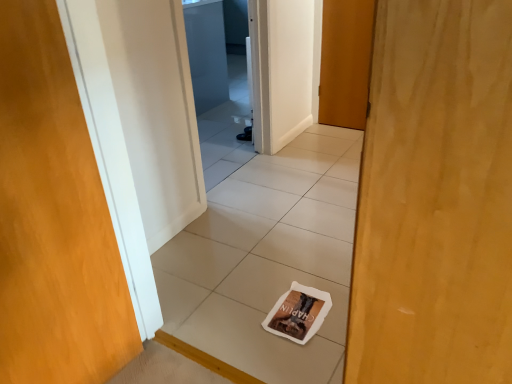
Find the location of a particular element. white tile at center is located at coordinates (268, 258).

The width and height of the screenshot is (512, 384). Find the location of `wooden door at left, which is the first door in bottom-to-top order`. wooden door at left, which is the first door in bottom-to-top order is located at coordinates (53, 218).

Where is `wooden door at center, the 2th door in the front-to-back sequence`? wooden door at center, the 2th door in the front-to-back sequence is located at coordinates click(346, 62).

From a real-world perspective, is transparent glass screen door at upper center physically below brown paper magazine at center?

No.

From the picture: Considering the sizes of objects transparent glass screen door at upper center and brown paper magazine at center in the image provided, who is thinner, transparent glass screen door at upper center or brown paper magazine at center?

With smaller width is brown paper magazine at center.

In the scene shown: Which object is closer to the camera, transparent glass screen door at upper center or brown paper magazine at center?

Positioned in front is brown paper magazine at center.

Which is correct: transparent glass screen door at upper center is inside brown paper magazine at center, or outside of it?

transparent glass screen door at upper center is not inside brown paper magazine at center, it's outside.

Does point (268, 325) come closer to viewer compared to point (192, 43)?

Yes, it is.

Is brown paper magazine at center looking in the opposite direction of transparent glass screen door at upper center?

No.

From the picture: Can you confirm if brown paper magazine at center is bigger than transparent glass screen door at upper center?

Actually, brown paper magazine at center might be smaller than transparent glass screen door at upper center.

Can you see white tile at center touching wooden door at center, the second door positioned from the bottom?

No, white tile at center is not making contact with wooden door at center, the second door positioned from the bottom.

Is white tile at center located outside wooden door at center, the second door positioned from the bottom?

Yes, white tile at center is outside of wooden door at center, the second door positioned from the bottom.

How different are the orientations of white tile at center and wooden door at center, which is the 1th door from top to bottom, in degrees?

The angular difference between white tile at center and wooden door at center, which is the 1th door from top to bottom, is 0.626 degrees.

Looking at this image, looking at the image, does white tile at center seem bigger or smaller compared to wooden door at center, the second door positioned from the bottom?

Clearly, white tile at center is larger in size than wooden door at center, the second door positioned from the bottom.

How many degrees apart are the facing directions of wooden door at left, which is the 2th door from top to bottom, and transparent glass screen door at upper center?

98.4 degrees separate the facing orientations of wooden door at left, which is the 2th door from top to bottom, and transparent glass screen door at upper center.

Is wooden door at left, the 2th door when ordered from right to left, far away from transparent glass screen door at upper center?

Yes, wooden door at left, the 2th door when ordered from right to left, is far from transparent glass screen door at upper center.

Is wooden door at left, which is the first door in front-to-back order, located outside transparent glass screen door at upper center?

Yes.

Considering the positions of objects wooden door at left, the first door when ordered from left to right, and transparent glass screen door at upper center in the image provided, who is more to the left, wooden door at left, the first door when ordered from left to right, or transparent glass screen door at upper center?

wooden door at left, the first door when ordered from left to right.

How distant is brown paper magazine at center from white tile at center?

brown paper magazine at center and white tile at center are 45.52 centimeters apart from each other.

Does brown paper magazine at center appear on the right side of white tile at center?

No, brown paper magazine at center is not to the right of white tile at center.

Is brown paper magazine at center in front of or behind white tile at center in the image?

Clearly, brown paper magazine at center is behind white tile at center.

Does brown paper magazine at center have a smaller size compared to white tile at center?

Yes, brown paper magazine at center is smaller than white tile at center.

From a real-world perspective, is brown paper magazine at center physically located above or below wooden door at left, which is the 2th door from top to bottom?

Clearly, from a real-world perspective, brown paper magazine at center is below wooden door at left, which is the 2th door from top to bottom.

From the image's perspective, who appears lower, brown paper magazine at center or wooden door at left, which is the first door in front-to-back order?

brown paper magazine at center is shown below in the image.

Considering the relative sizes of brown paper magazine at center and wooden door at left, the first door when ordered from left to right, in the image provided, is brown paper magazine at center shorter than wooden door at left, the first door when ordered from left to right,?

Yes.

Can you confirm if brown paper magazine at center is positioned to the right of wooden door at left, which is the first door in front-to-back order?

Yes, brown paper magazine at center is to the right of wooden door at left, which is the first door in front-to-back order.

What's the angular difference between wooden door at center, the 2th door in the front-to-back sequence, and transparent glass screen door at upper center's facing directions?

180 degrees.

Can you confirm if wooden door at center, the 2th door in the front-to-back sequence, is thinner than transparent glass screen door at upper center?

Correct, the width of wooden door at center, the 2th door in the front-to-back sequence, is less than that of transparent glass screen door at upper center.

Between wooden door at center, which is the 1th door in back-to-front order, and transparent glass screen door at upper center, which one appears on the right side from the viewer's perspective?

From the viewer's perspective, wooden door at center, which is the 1th door in back-to-front order, appears more on the right side.

Does wooden door at center, the second door positioned from the bottom, come in front of transparent glass screen door at upper center?

Yes, it is.

Image resolution: width=512 pixels, height=384 pixels. I want to click on screen door that appears behind the brown paper magazine at center, so click(x=207, y=53).

Where is `magazine in front of the transparent glass screen door at upper center`? This screenshot has height=384, width=512. magazine in front of the transparent glass screen door at upper center is located at coordinates (296, 314).

From the image, which object appears to be farther from white tile at center, wooden door at left, the first door when ordered from left to right, or wooden door at center, placed as the 2th door when sorted from left to right?

Among the two, wooden door at center, placed as the 2th door when sorted from left to right, is located further to white tile at center.

Which object lies nearer to the anchor point white tile at center, transparent glass screen door at upper center or wooden door at center, the 2th door in the front-to-back sequence?

Based on the image, wooden door at center, the 2th door in the front-to-back sequence, appears to be nearer to white tile at center.

From the image, which object appears to be farther from wooden door at left, which is the first door in bottom-to-top order, white tile at center or wooden door at center, the second door positioned from the bottom?

wooden door at center, the second door positioned from the bottom, lies further to wooden door at left, which is the first door in bottom-to-top order, than the other object.

Based on their spatial positions, is transparent glass screen door at upper center or wooden door at left, which is counted as the 2th door, starting from the back, closer to brown paper magazine at center?

Among the two, wooden door at left, which is counted as the 2th door, starting from the back, is located nearer to brown paper magazine at center.

Estimate the real-world distances between objects in this image. Which object is closer to white tile at center, brown paper magazine at center or transparent glass screen door at upper center?

brown paper magazine at center is closer to white tile at center.

Looking at the image, which one is located closer to wooden door at center, which is the 1th door in back-to-front order, white tile at center or brown paper magazine at center?

white tile at center.

Which object lies further to the anchor point white tile at center, transparent glass screen door at upper center or wooden door at left, the 2th door when ordered from right to left?

transparent glass screen door at upper center lies further to white tile at center than the other object.

Looking at this image, when comparing their distances from transparent glass screen door at upper center, does brown paper magazine at center or white tile at center seem further?

brown paper magazine at center is positioned further to the anchor transparent glass screen door at upper center.

Identify the location of magazine located between wooden door at left, which is counted as the 2th door, starting from the back, and transparent glass screen door at upper center in the depth direction. This screenshot has width=512, height=384. (296, 314).

Find the location of a particular element. Image resolution: width=512 pixels, height=384 pixels. magazine located between wooden door at left, which is counted as the 2th door, starting from the back, and wooden door at center, placed as the 2th door when sorted from left to right, in the depth direction is located at coordinates (296, 314).

Find the location of a particular element. Image resolution: width=512 pixels, height=384 pixels. magazine between white tile at center and transparent glass screen door at upper center along the z-axis is located at coordinates (296, 314).

The image size is (512, 384). In order to click on magazine located between white tile at center and wooden door at center, placed as the 2th door when sorted from left to right, in the depth direction in this screenshot , I will do `click(296, 314)`.